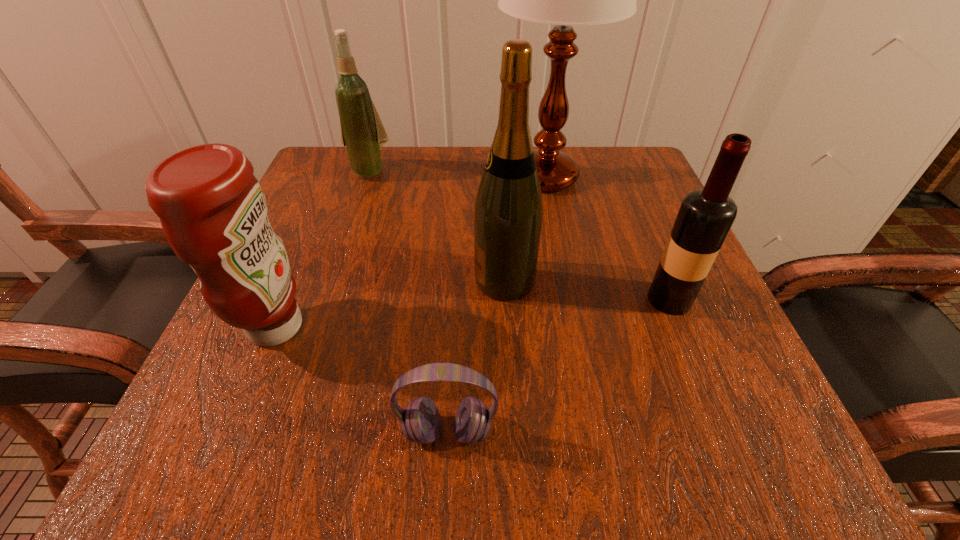
Locate an element on the screen. blank region between the tallest object and the condiment is located at coordinates (411, 252).

The height and width of the screenshot is (540, 960). I want to click on vacant space that is in between the leftmost wine bottle and the nearest object, so click(408, 301).

This screenshot has height=540, width=960. Find the location of `vacant region between the leftmost wine bottle and the nearest object`. vacant region between the leftmost wine bottle and the nearest object is located at coordinates (408, 301).

Locate an element on the screen. vacant region between the tallest object and the rightmost wine bottle is located at coordinates (608, 238).

Find the location of a particular element. The height and width of the screenshot is (540, 960). vacant area that lies between the leftmost wine bottle and the headset is located at coordinates (408, 301).

Identify the location of free space between the nearest object and the tallest object. Image resolution: width=960 pixels, height=540 pixels. (496, 305).

This screenshot has height=540, width=960. In order to click on empty location between the shortest object and the rightmost object in this screenshot , I will do (559, 365).

Identify the location of vacant point located between the tallest object and the farthest wine bottle. (457, 174).

Identify the location of vacant area that lies between the headset and the condiment. The image size is (960, 540). (362, 379).

Find the location of `the fourth closest object to the rightmost object`. the fourth closest object to the rightmost object is located at coordinates (213, 212).